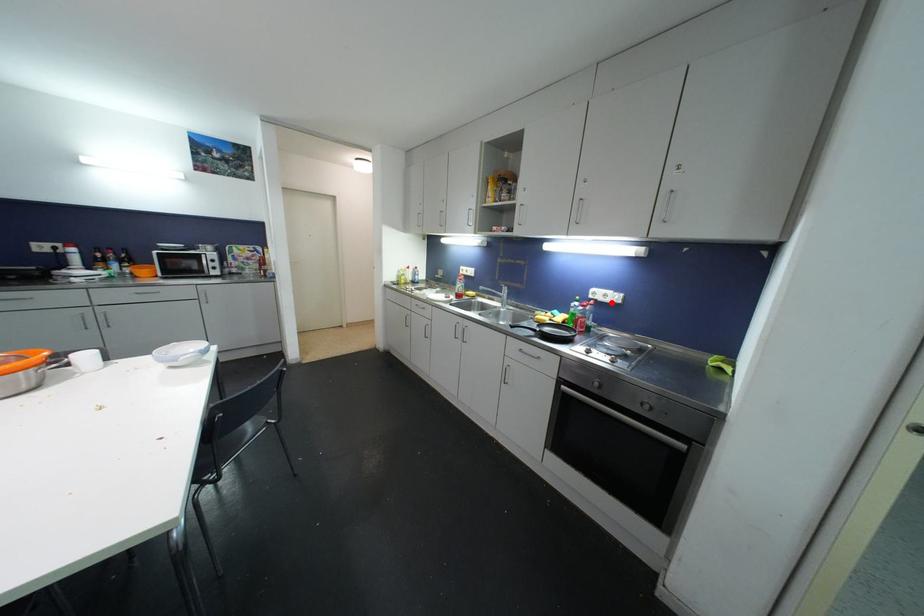
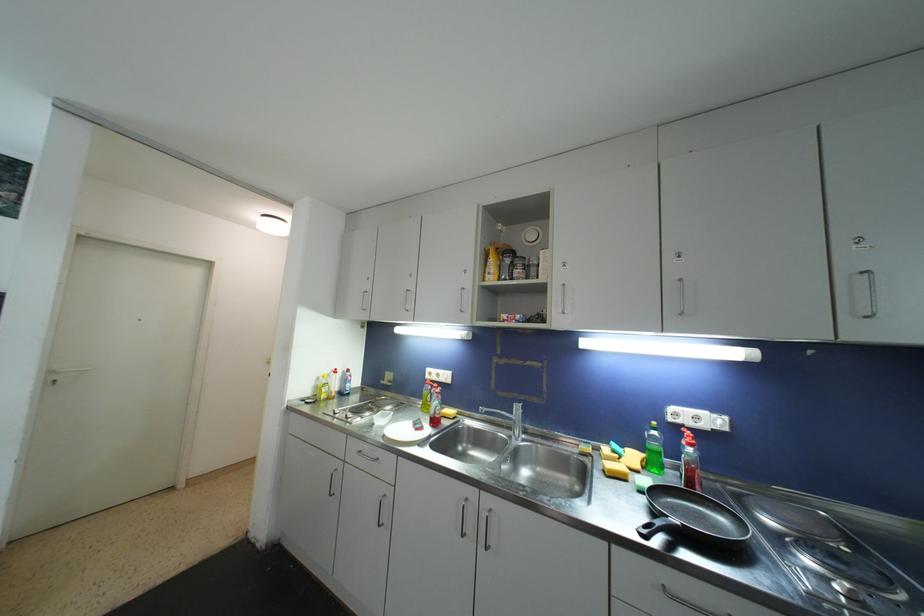
Find the pixel in the second image that matches the highlighted location in the first image.

(708, 429)